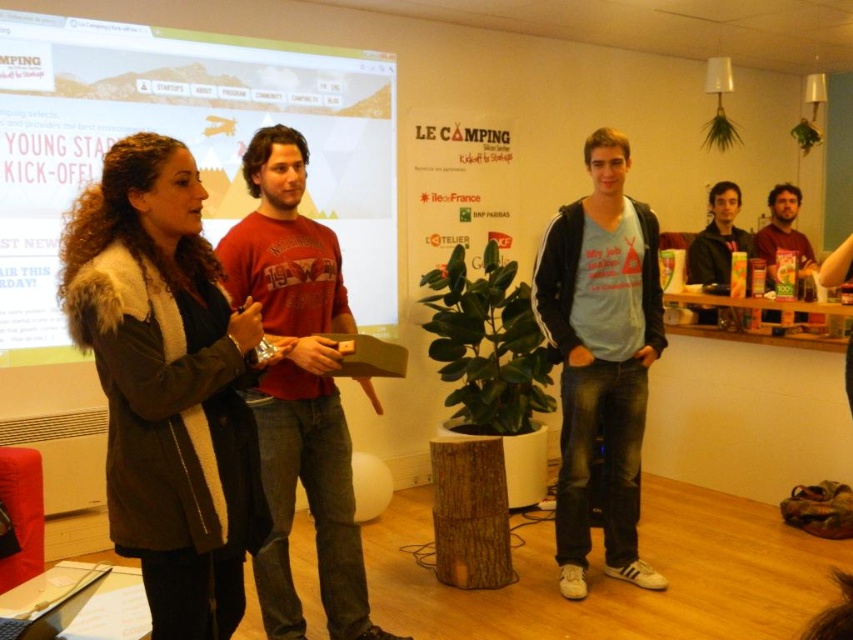
Is matte white poster at upper left wider than matte red t-shirt at center?

Yes.

Is matte white poster at upper left in front of matte red t-shirt at center?

No, it is not.

You are a GUI agent. You are given a task and a screenshot of the screen. Output one action in this format:
    pyautogui.click(x=<x>, y=<y>)
    Task: Click on the matte white poster at upper left
    Image resolution: width=853 pixels, height=640 pixels.
    Given the screenshot: What is the action you would take?
    pyautogui.click(x=184, y=144)

Between point (582, 308) and point (708, 257), which one is positioned in front?

Positioned in front is point (582, 308).

Is denim jeans at center to the right of matte black jacket at right from the viewer's perspective?

Incorrect, denim jeans at center is not on the right side of matte black jacket at right.

The height and width of the screenshot is (640, 853). I want to click on denim jeans at center, so click(x=601, y=356).

Find the location of `denim jeans at center`. denim jeans at center is located at coordinates (601, 356).

Does point (308, 477) come in front of point (699, 252)?

Yes, it is in front of point (699, 252).

How much distance is there between matte red t-shirt at center and matte black jacket at right?

The distance of matte red t-shirt at center from matte black jacket at right is 2.96 meters.

This screenshot has width=853, height=640. I want to click on matte red t-shirt at center, so click(299, 388).